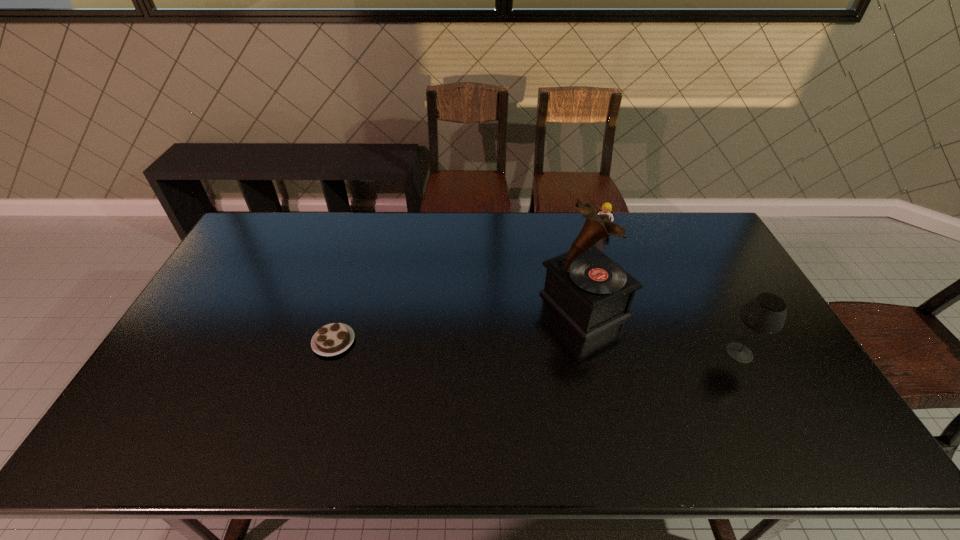
Locate an element on the screen. This screenshot has width=960, height=540. vacant space that's between the phonograph_record and the chocolate cake is located at coordinates (459, 323).

Where is `object that stands as the third closest to the tallest object`? This screenshot has height=540, width=960. object that stands as the third closest to the tallest object is located at coordinates (332, 339).

The height and width of the screenshot is (540, 960). Identify the location of object that stands as the closest to the chocolate cake. (593, 293).